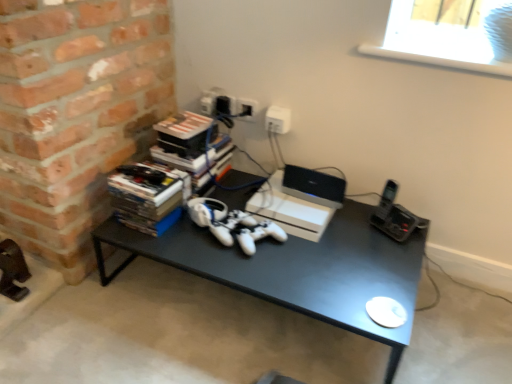
Locate an element on the screen. empty space that is ontop of white plastic window screen at upper right (from a real-world perspective) is located at coordinates (442, 43).